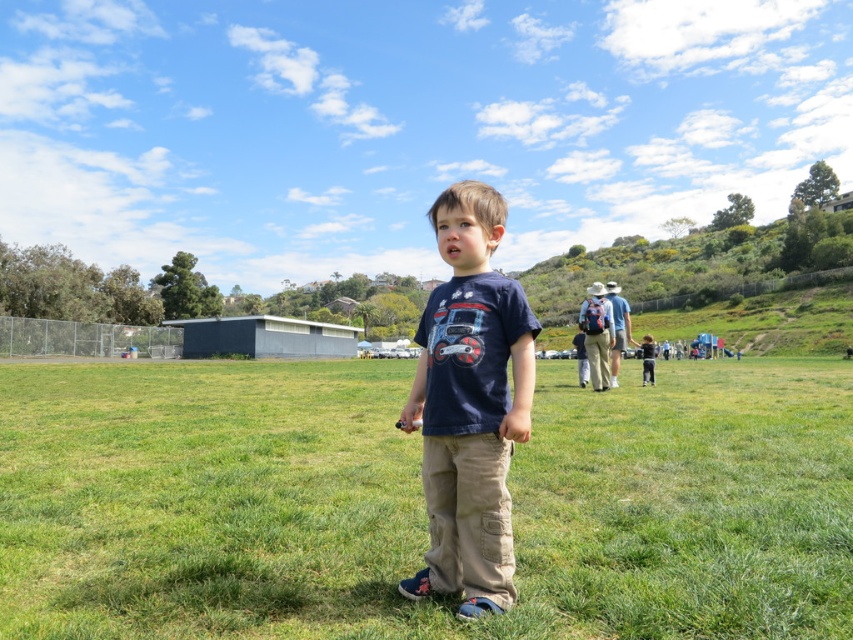
Consider the image. Can you confirm if green grassy field at center is shorter than dark blue t-shirt at center?

Indeed, green grassy field at center has a lesser height compared to dark blue t-shirt at center.

Between green grassy field at center and dark blue t-shirt at center, which one has more height?

Standing taller between the two is dark blue t-shirt at center.

What do you see at coordinates (419, 502) in the screenshot? The image size is (853, 640). I see `green grassy field at center` at bounding box center [419, 502].

Find the location of a particular element. green grassy field at center is located at coordinates (419, 502).

Is point (445, 444) positioned in front of point (651, 355)?

Yes, point (445, 444) is in front of point (651, 355).

Is point (434, 593) in front of point (643, 355)?

That is True.

At what (x,y) coordinates should I click in order to perform the action: click on navy blue t-shirt at center. Please return your answer as a coordinate pair (x, y). The height and width of the screenshot is (640, 853). Looking at the image, I should click on (469, 404).

Does point (328, 531) lie in front of point (445, 368)?

That is False.

Who is positioned more to the right, green grassy field at center or navy blue t-shirt at center?

green grassy field at center is more to the right.

What do you see at coordinates (419, 502) in the screenshot? Image resolution: width=853 pixels, height=640 pixels. I see `green grassy field at center` at bounding box center [419, 502].

You are a GUI agent. You are given a task and a screenshot of the screen. Output one action in this format:
    pyautogui.click(x=<x>, y=<y>)
    Task: Click on the green grassy field at center
    
    Given the screenshot: What is the action you would take?
    pyautogui.click(x=419, y=502)